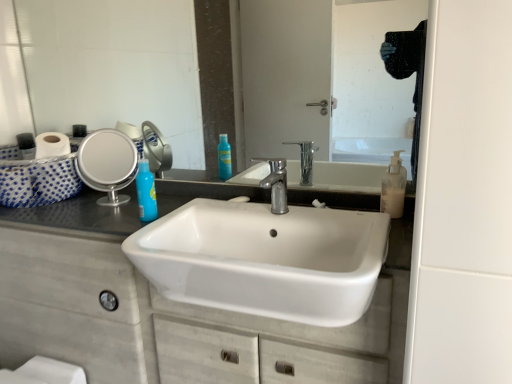
Measure the distance between polished chrome faucet at center and camera.

polished chrome faucet at center and camera are 1.07 meters apart from each other.

Where is `blue glossy bottle at upper left`? blue glossy bottle at upper left is located at coordinates (146, 192).

In order to face white ceramic sink at center, should I rotate leftwards or rightwards?

Turn right approximately 0.449 degrees to face it.

The image size is (512, 384). Identify the location of glossy glass mirror at upper center, the first mirror in the right-to-left sequence. (323, 79).

From a real-world perspective, is glossy glass mirror at upper center, the first mirror in the right-to-left sequence, beneath white ceramic sink at center?

No, from a real-world perspective, glossy glass mirror at upper center, the first mirror in the right-to-left sequence, is not beneath white ceramic sink at center.

How many degrees apart are the facing directions of glossy glass mirror at upper center, marked as the second mirror in a left-to-right arrangement, and white ceramic sink at center?

The angular difference between glossy glass mirror at upper center, marked as the second mirror in a left-to-right arrangement, and white ceramic sink at center is 0.674 degrees.

Are glossy glass mirror at upper center, marked as the second mirror in a left-to-right arrangement, and white ceramic sink at center beside each other?

glossy glass mirror at upper center, marked as the second mirror in a left-to-right arrangement, and white ceramic sink at center are not in contact.

Would you say glossy glass mirror at upper center, the first mirror in the right-to-left sequence, is to the left or to the right of white ceramic sink at center in the picture?

Based on their positions, glossy glass mirror at upper center, the first mirror in the right-to-left sequence, is located to the left of white ceramic sink at center.

From the image's perspective, who appears lower, white matte cabinet at center or silver metallic mirror at left, the first mirror from the left?

white matte cabinet at center appears lower in the image.

From a real-world perspective, does white matte cabinet at center sit lower than silver metallic mirror at left, the first mirror from the left?

Yes, from a real-world perspective, white matte cabinet at center is beneath silver metallic mirror at left, the first mirror from the left.

At what (x,y) coordinates should I click in order to perform the action: click on the 1st mirror positioned above the white matte cabinet at center (from the image's perspective). Please return your answer as a coordinate pair (x, y). Looking at the image, I should click on (106, 164).

Considering the positions of objects white matte cabinet at center and silver metallic mirror at left, the first mirror from the left, in the image provided, who is behind, white matte cabinet at center or silver metallic mirror at left, the first mirror from the left,?

silver metallic mirror at left, the first mirror from the left, is further from the camera.

What's the angular difference between blue glossy bottle at upper left and translucent plastic soap dispenser at right's facing directions?

blue glossy bottle at upper left and translucent plastic soap dispenser at right are facing 1.55 degrees away from each other.

Is point (145, 199) farther from viewer compared to point (390, 213)?

Yes.

Which is behind, blue glossy bottle at upper left or translucent plastic soap dispenser at right?

blue glossy bottle at upper left is further away from the camera.

Considering the sizes of objects white ceramic sink at center and silver metallic mirror at left, the 2th mirror viewed from the right, in the image provided, who is taller, white ceramic sink at center or silver metallic mirror at left, the 2th mirror viewed from the right,?

With more height is silver metallic mirror at left, the 2th mirror viewed from the right.

Is white ceramic sink at center closer to camera compared to silver metallic mirror at left, the 2th mirror viewed from the right?

Yes, white ceramic sink at center is closer to the viewer.

Does white ceramic sink at center have a smaller size compared to silver metallic mirror at left, the 2th mirror viewed from the right?

Actually, white ceramic sink at center might be larger than silver metallic mirror at left, the 2th mirror viewed from the right.

Is white ceramic sink at center facing towards silver metallic mirror at left, the 2th mirror viewed from the right?

No, white ceramic sink at center does not turn towards silver metallic mirror at left, the 2th mirror viewed from the right.

Which is behind, white matte cabinet at center or translucent plastic soap dispenser at right?

translucent plastic soap dispenser at right.

Is white matte cabinet at center directly adjacent to translucent plastic soap dispenser at right?

No.

Choose the correct answer: Is white matte cabinet at center inside translucent plastic soap dispenser at right or outside it?

white matte cabinet at center is spatially situated outside translucent plastic soap dispenser at right.

Can you confirm if white matte cabinet at center is bigger than translucent plastic soap dispenser at right?

Yes.

In the scene shown: Is translucent plastic soap dispenser at right further to the viewer compared to polished chrome faucet at center?

That is True.

Looking at this image, between translucent plastic soap dispenser at right and polished chrome faucet at center, which one appears on the right side from the viewer's perspective?

Positioned to the right is translucent plastic soap dispenser at right.

Locate an element on the screen. tap in front of the translucent plastic soap dispenser at right is located at coordinates (276, 184).

Considering the sizes of objects translucent plastic soap dispenser at right and polished chrome faucet at center in the image provided, who is shorter, translucent plastic soap dispenser at right or polished chrome faucet at center?

translucent plastic soap dispenser at right is shorter.

Which is in front, point (119, 162) or point (260, 73)?

The point (260, 73) is in front.

Is glossy glass mirror at upper center, the first mirror in the right-to-left sequence, at the back of silver metallic mirror at left, the first mirror from the left?

Yes, silver metallic mirror at left, the first mirror from the left,'s orientation is away from glossy glass mirror at upper center, the first mirror in the right-to-left sequence.

Considering the positions of objects silver metallic mirror at left, the first mirror from the left, and glossy glass mirror at upper center, the first mirror in the right-to-left sequence, in the image provided, who is more to the left, silver metallic mirror at left, the first mirror from the left, or glossy glass mirror at upper center, the first mirror in the right-to-left sequence,?

silver metallic mirror at left, the first mirror from the left, is more to the left.

Considering the sizes of silver metallic mirror at left, the 2th mirror viewed from the right, and glossy glass mirror at upper center, the first mirror in the right-to-left sequence, in the image, is silver metallic mirror at left, the 2th mirror viewed from the right, wider or thinner than glossy glass mirror at upper center, the first mirror in the right-to-left sequence,?

silver metallic mirror at left, the 2th mirror viewed from the right, is wider than glossy glass mirror at upper center, the first mirror in the right-to-left sequence.

Where is `sink in front of the glossy glass mirror at upper center, the first mirror in the right-to-left sequence`? sink in front of the glossy glass mirror at upper center, the first mirror in the right-to-left sequence is located at coordinates (265, 259).

At what (x,y) coordinates should I click in order to perform the action: click on the 2nd mirror behind the white matte cabinet at center, counting from the anchor's position. Please return your answer as a coordinate pair (x, y). This screenshot has height=384, width=512. Looking at the image, I should click on (106, 164).

Estimate the real-world distances between objects in this image. Which object is further from white ceramic sink at center, polished chrome faucet at center or white matte cabinet at center?

polished chrome faucet at center.

Considering their positions, is glossy glass mirror at upper center, marked as the second mirror in a left-to-right arrangement, positioned further to white ceramic sink at center than silver metallic mirror at left, the 2th mirror viewed from the right?

The object further to white ceramic sink at center is silver metallic mirror at left, the 2th mirror viewed from the right.

Estimate the real-world distances between objects in this image. Which object is closer to silver metallic mirror at left, the first mirror from the left, white ceramic sink at center or translucent plastic soap dispenser at right?

white ceramic sink at center is closer to silver metallic mirror at left, the first mirror from the left.

Which object lies further to the anchor point white ceramic sink at center, glossy glass mirror at upper center, marked as the second mirror in a left-to-right arrangement, or blue glossy bottle at upper left?

glossy glass mirror at upper center, marked as the second mirror in a left-to-right arrangement, is positioned further to the anchor white ceramic sink at center.

Based on their spatial positions, is glossy glass mirror at upper center, the first mirror in the right-to-left sequence, or polished chrome faucet at center further from white matte cabinet at center?

glossy glass mirror at upper center, the first mirror in the right-to-left sequence, lies further to white matte cabinet at center than the other object.

Which object lies nearer to the anchor point silver metallic mirror at left, the first mirror from the left, polished chrome faucet at center or white ceramic sink at center?

Based on the image, polished chrome faucet at center appears to be nearer to silver metallic mirror at left, the first mirror from the left.

Based on their spatial positions, is glossy glass mirror at upper center, marked as the second mirror in a left-to-right arrangement, or white ceramic sink at center further from white matte cabinet at center?

Among the two, glossy glass mirror at upper center, marked as the second mirror in a left-to-right arrangement, is located further to white matte cabinet at center.

Based on their spatial positions, is blue glossy bottle at upper left or glossy glass mirror at upper center, the first mirror in the right-to-left sequence, closer to white ceramic sink at center?

blue glossy bottle at upper left lies closer to white ceramic sink at center than the other object.

Where is `sink between blue glossy bottle at upper left and white matte cabinet at center from top to bottom`? sink between blue glossy bottle at upper left and white matte cabinet at center from top to bottom is located at coordinates (265, 259).

At what (x,y) coordinates should I click in order to perform the action: click on tap between glossy glass mirror at upper center, the first mirror in the right-to-left sequence, and white ceramic sink at center in the up-down direction. Please return your answer as a coordinate pair (x, y). The image size is (512, 384). Looking at the image, I should click on (276, 184).

What are the coordinates of `sink between polished chrome faucet at center and white matte cabinet at center vertically` in the screenshot? It's located at (265, 259).

At what (x,y) coordinates should I click in order to perform the action: click on tap between glossy glass mirror at upper center, marked as the second mirror in a left-to-right arrangement, and white matte cabinet at center vertically. Please return your answer as a coordinate pair (x, y). The width and height of the screenshot is (512, 384). Looking at the image, I should click on (276, 184).